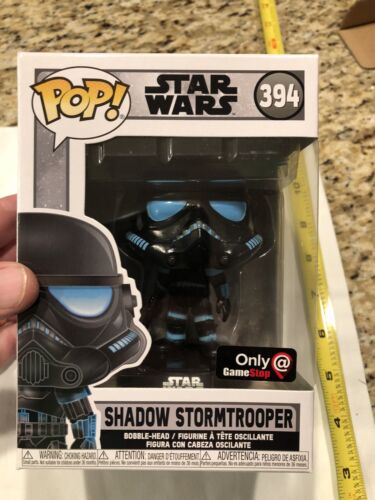
Identify the location of sticker. (271, 361).